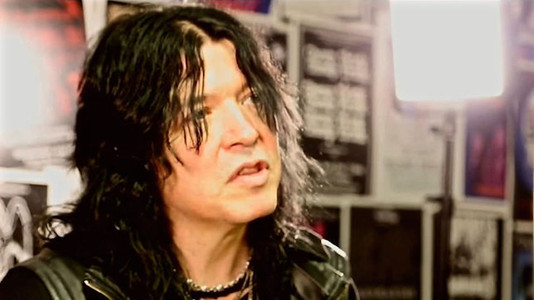
Where is `light`? light is located at coordinates (451, 58).